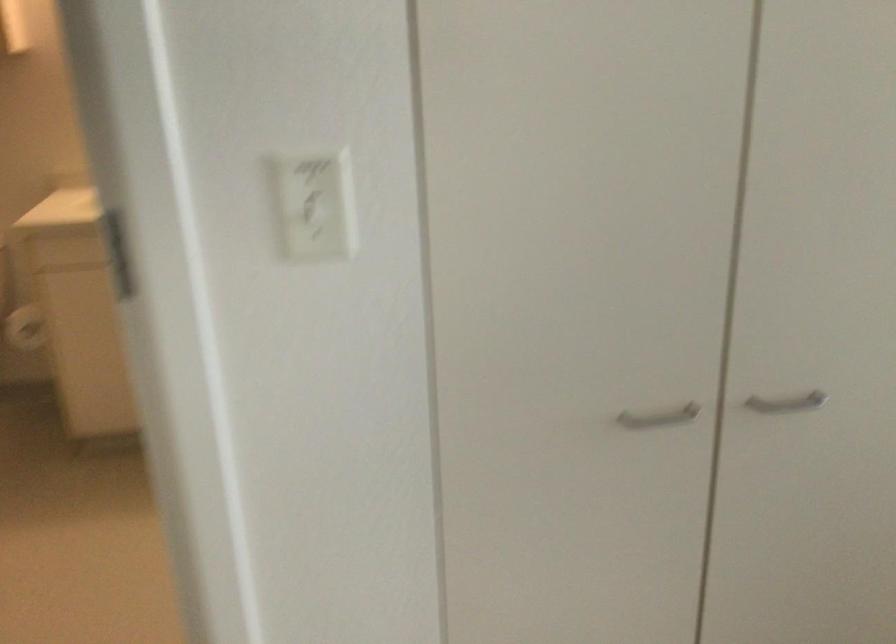
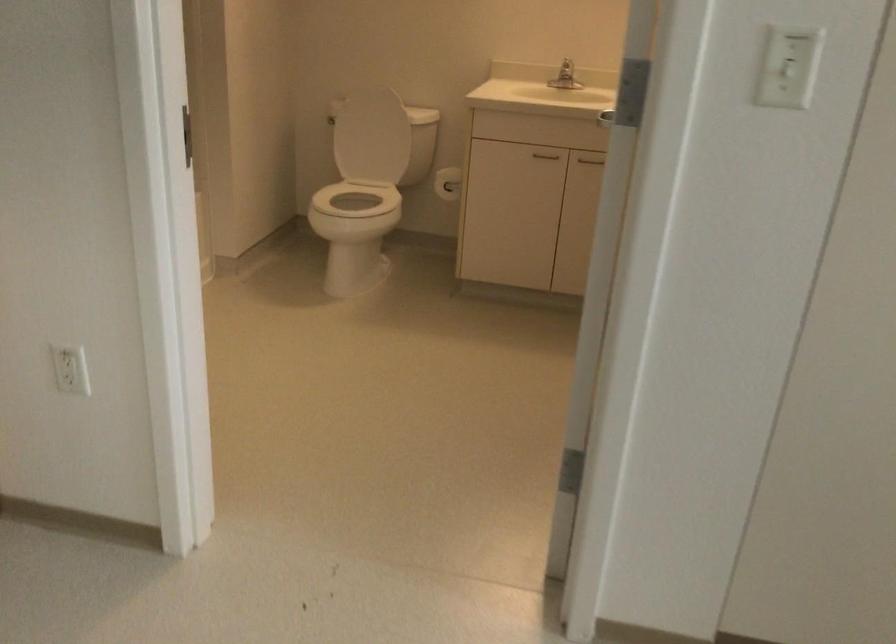
Question: The images are taken continuously from a first-person perspective. In which direction are you moving?

Choices:
 (A) Left
 (B) Right
 (C) Forward
 (D) Backward

Answer: (D)